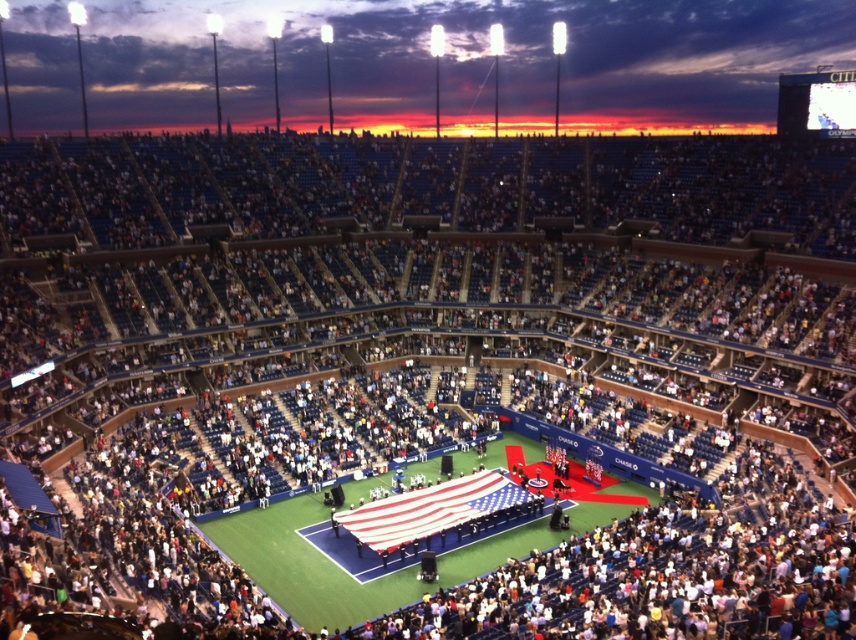
Question: In this image, where is green artificial turf at center located relative to american flag at center?

Choices:
 (A) below
 (B) above

Answer: (A)

Question: Does green artificial turf at center have a lesser width compared to american flag at center?

Choices:
 (A) no
 (B) yes

Answer: (A)

Question: Which of the following is the closest to the observer?

Choices:
 (A) american flag at center
 (B) green artificial turf at center

Answer: (B)

Question: Where is green artificial turf at center located in relation to american flag at center in the image?

Choices:
 (A) left
 (B) right

Answer: (A)

Question: Which point is farther to the camera?

Choices:
 (A) green artificial turf at center
 (B) american flag at center

Answer: (B)

Question: Which point is closer to the camera?

Choices:
 (A) green artificial turf at center
 (B) american flag at center

Answer: (A)